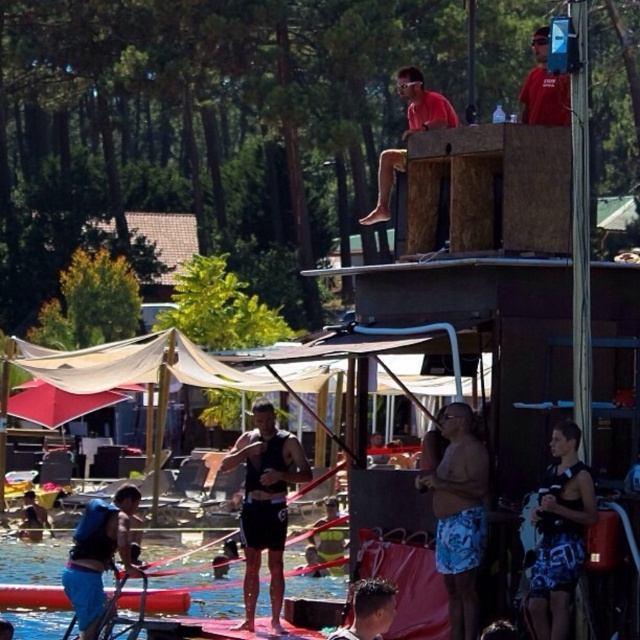
You are standing at the edge of the platform and want to jump into the water. Which direction should you jump to land in the blue fabric water at lower left without hitting the matte red shirt at upper center?

You should jump to the left because the blue fabric water at lower left is positioned to the left of the matte red shirt at upper center, so jumping left will avoid the shirt and land in the water.

You are standing at the edge of the platform and want to locate two specific points in the water below. The first point is labeled as point [563,593] and the second is point [394,602]. From your vantage point on the platform, which point would appear closer to you?

Point [394,602] would appear closer to you because it is in front of point [563,593].

You are standing at the edge of the wooden platform in the water park scene. You notice two points marked in the image. Which point, point 1 at coordinates (x=456, y=573) or point 2 at (x=90, y=509), is closer to you?

Point 1 at coordinates (x=456, y=573) is closer to you as it is nearer to the viewer compared to point 2 at (x=90, y=509).